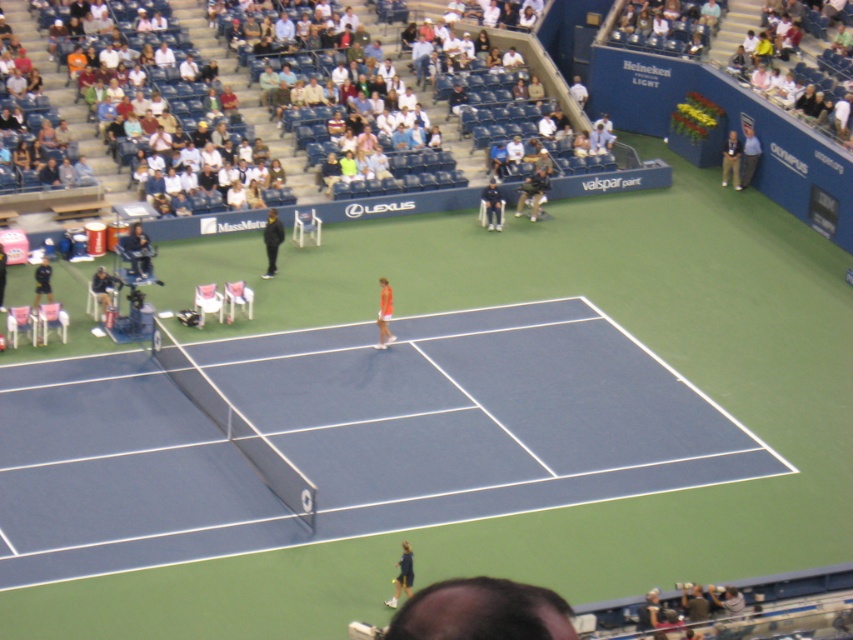
This screenshot has height=640, width=853. What are the coordinates of `blue synthetic surface at center` in the screenshot? It's located at (343, 436).

Find the location of a particular element. This screenshot has width=853, height=640. blue synthetic surface at center is located at coordinates (343, 436).

Does blue synthetic surface at center have a greater width compared to khaki pants at upper right?

Yes.

Who is lower down, blue synthetic surface at center or khaki pants at upper right?

Positioned lower is blue synthetic surface at center.

Does point (589, 340) come behind point (722, 186)?

No, it is in front of (722, 186).

Locate an element on the screen. Image resolution: width=853 pixels, height=640 pixels. blue synthetic surface at center is located at coordinates (343, 436).

Between point (405, 556) and point (267, 228), which one is positioned behind?

The point (267, 228) is more distant.

Does dark blue fabric tennis outfit at lower center appear on the right side of black matte jacket at upper center?

Correct, you'll find dark blue fabric tennis outfit at lower center to the right of black matte jacket at upper center.

Is point (398, 580) behind point (271, 209)?

No.

The height and width of the screenshot is (640, 853). In order to click on dark blue fabric tennis outfit at lower center in this screenshot , I will do `click(402, 576)`.